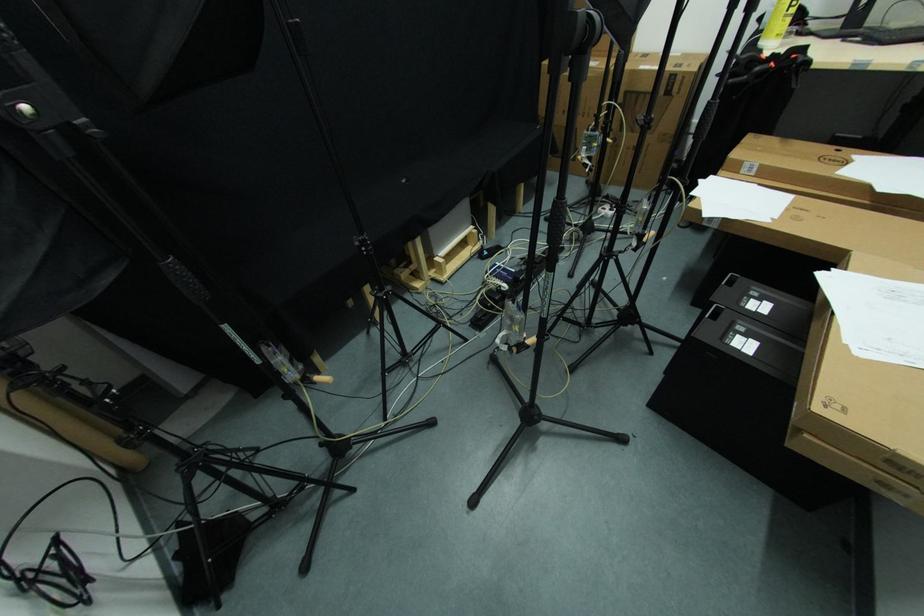
What are the coordinates of `white paper sheet` in the screenshot? It's located at pos(877,315).